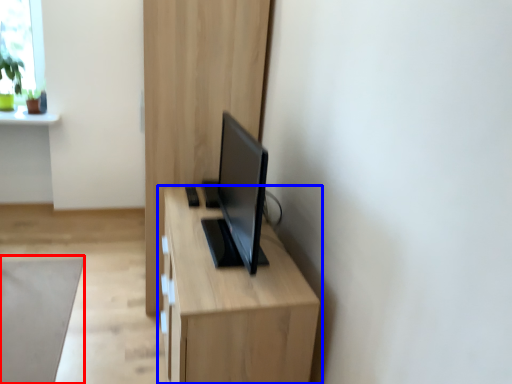
Question: Which of the following is the closest to the observer, plain (highlighted by a red box) or table (highlighted by a blue box)?

Choices:
 (A) plain
 (B) table

Answer: (B)